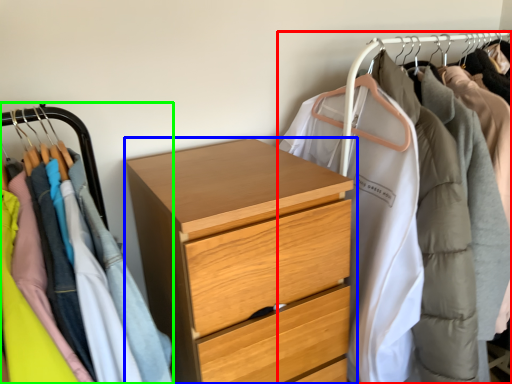
Question: Considering the real-world distances, which object is closest to closet (highlighted by a red box)? chest of drawers (highlighted by a blue box) or closet (highlighted by a green box).

Choices:
 (A) chest of drawers
 (B) closet

Answer: (A)